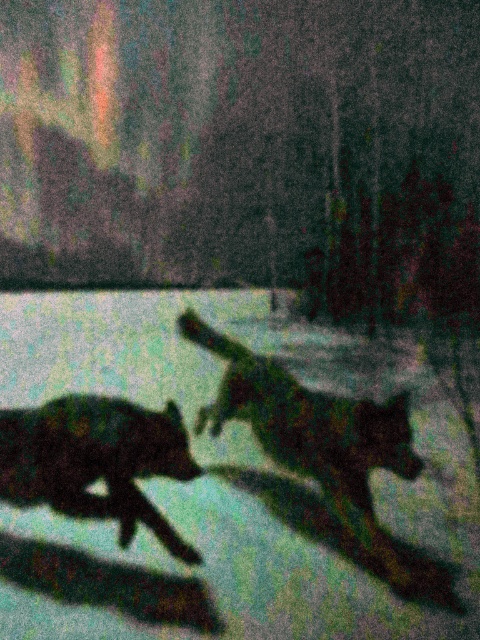
Can you confirm if shiny black dog at center is positioned to the right of silhouette fur at lower left?

Indeed, shiny black dog at center is positioned on the right side of silhouette fur at lower left.

Which of these two, shiny black dog at center or silhouette fur at lower left, stands shorter?

With less height is silhouette fur at lower left.

Describe the element at coordinates (327, 456) in the screenshot. I see `shiny black dog at center` at that location.

Where is `shiny black dog at center`? This screenshot has width=480, height=640. shiny black dog at center is located at coordinates (327, 456).